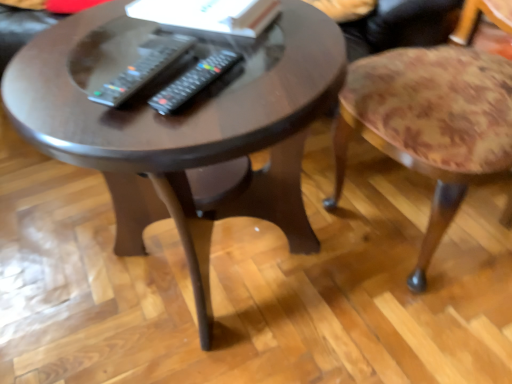
Identify the location of black plastic remote at center, acting as the 1th remote starting from the right. (193, 81).

Describe the element at coordinates (181, 122) in the screenshot. I see `dark wood coffee table at center` at that location.

At what (x,y) coordinates should I click in order to perform the action: click on black plastic remote at center, acting as the 1th remote starting from the right. Please return your answer as a coordinate pair (x, y). Looking at the image, I should click on (193, 81).

Based on the photo, from a real-world perspective, who is located higher, dark wood coffee table at center or floral fabric stool at right?

floral fabric stool at right.

You are a GUI agent. You are given a task and a screenshot of the screen. Output one action in this format:
    pyautogui.click(x=<x>, y=<y>)
    Task: Click on the coffee table located in front of the floral fabric stool at right
    The height and width of the screenshot is (384, 512).
    Given the screenshot: What is the action you would take?
    pyautogui.click(x=181, y=122)

Is floral fabric stool at right a part of dark wood coffee table at center?

Definitely not — floral fabric stool at right is not inside dark wood coffee table at center.

Which is closer to the camera, (x=325, y=88) or (x=369, y=127)?

Point (x=325, y=88) is closer to the camera than point (x=369, y=127).

Between black plastic remote at center, marked as the second remote in a left-to-right arrangement, and floral fabric stool at right, which one is positioned behind?

black plastic remote at center, marked as the second remote in a left-to-right arrangement, is further from the camera.

Would you say black plastic remote at center, marked as the second remote in a left-to-right arrangement, contains floral fabric stool at right?

No, black plastic remote at center, marked as the second remote in a left-to-right arrangement, does not contain floral fabric stool at right.

Consider the image. Who is smaller, black plastic remote at center, acting as the 1th remote starting from the right, or floral fabric stool at right?

With smaller size is black plastic remote at center, acting as the 1th remote starting from the right.

Considering the relative sizes of floral fabric stool at right and dark wood coffee table at center in the image provided, is floral fabric stool at right bigger than dark wood coffee table at center?

Incorrect, floral fabric stool at right is not larger than dark wood coffee table at center.

Is floral fabric stool at right wider or thinner than dark wood coffee table at center?

In the image, floral fabric stool at right appears to be more narrow than dark wood coffee table at center.

From a real-world perspective, is floral fabric stool at right above or below dark wood coffee table at center?

From a real-world perspective, floral fabric stool at right is physically above dark wood coffee table at center.

From the image's perspective, is floral fabric stool at right above or below dark wood coffee table at center?

From the image's perspective, floral fabric stool at right appears above dark wood coffee table at center.

From the image's perspective, is black plastic remote at center, which appears as the 1th remote when viewed from the left, beneath floral fabric stool at right?

No.

Is black plastic remote at center, which ranks as the second remote in right-to-left order, oriented away from floral fabric stool at right?

black plastic remote at center, which ranks as the second remote in right-to-left order, does not have its back to floral fabric stool at right.

From the picture: How far apart are black plastic remote at center, which ranks as the second remote in right-to-left order, and floral fabric stool at right?

black plastic remote at center, which ranks as the second remote in right-to-left order, is 49.42 centimeters away from floral fabric stool at right.

Are black plastic remote at center, which appears as the 1th remote when viewed from the left, and floral fabric stool at right making contact?

No, black plastic remote at center, which appears as the 1th remote when viewed from the left, is not touching floral fabric stool at right.

From the floral fabric stool at right, count the 2nd remote to the left and point to it. Please provide its 2D coordinates.

[(145, 68)]

Would you say floral fabric stool at right is to the left or to the right of black plastic remote at center, which ranks as the second remote in right-to-left order, in the picture?

In the image, floral fabric stool at right appears on the right side of black plastic remote at center, which ranks as the second remote in right-to-left order.

Is floral fabric stool at right positioned far away from black plastic remote at center, which appears as the 1th remote when viewed from the left?

No, floral fabric stool at right is not far from black plastic remote at center, which appears as the 1th remote when viewed from the left.

Is floral fabric stool at right in front of or behind black plastic remote at center, which ranks as the second remote in right-to-left order, in the image?

In the image, floral fabric stool at right appears in front of black plastic remote at center, which ranks as the second remote in right-to-left order.

How much distance is there between black plastic remote at center, acting as the 1th remote starting from the right, and black plastic remote at center, which ranks as the second remote in right-to-left order?

black plastic remote at center, acting as the 1th remote starting from the right, is 5.69 centimeters from black plastic remote at center, which ranks as the second remote in right-to-left order.

Is black plastic remote at center, acting as the 1th remote starting from the right, in front of or behind black plastic remote at center, which ranks as the second remote in right-to-left order, in the image?

black plastic remote at center, acting as the 1th remote starting from the right, is in front of black plastic remote at center, which ranks as the second remote in right-to-left order.

Which point is more forward, (232, 60) or (118, 102)?

The point (118, 102) is more forward.

Which object is positioned more to the left, black plastic remote at center, acting as the 1th remote starting from the right, or black plastic remote at center, which ranks as the second remote in right-to-left order?

black plastic remote at center, which ranks as the second remote in right-to-left order.

Who is smaller, black plastic remote at center, which appears as the 1th remote when viewed from the left, or black plastic remote at center, marked as the second remote in a left-to-right arrangement?

black plastic remote at center, marked as the second remote in a left-to-right arrangement, is smaller.

Considering the points (113, 89) and (175, 103), which point is behind, point (113, 89) or point (175, 103)?

Positioned behind is point (175, 103).

Identify the location of remote below the black plastic remote at center, which appears as the 1th remote when viewed from the left (from the image's perspective). The height and width of the screenshot is (384, 512). (193, 81).

Can you confirm if black plastic remote at center, which ranks as the second remote in right-to-left order, is shorter than black plastic remote at center, acting as the 1th remote starting from the right?

No, black plastic remote at center, which ranks as the second remote in right-to-left order, is not shorter than black plastic remote at center, acting as the 1th remote starting from the right.

I want to click on stool on the right of dark wood coffee table at center, so [x=430, y=123].

You are a GUI agent. You are given a task and a screenshot of the screen. Output one action in this format:
    pyautogui.click(x=<x>, y=<y>)
    Task: Click on the remote that is the 1st one when counting leftward from the floral fabric stool at right
    
    Given the screenshot: What is the action you would take?
    pyautogui.click(x=193, y=81)

Estimate the real-world distances between objects in this image. Which object is closer to floral fabric stool at right, dark wood coffee table at center or black plastic remote at center, acting as the 1th remote starting from the right?

Based on the image, dark wood coffee table at center appears to be nearer to floral fabric stool at right.

Looking at the image, which one is located closer to dark wood coffee table at center, floral fabric stool at right or black plastic remote at center, acting as the 1th remote starting from the right?

The object closer to dark wood coffee table at center is black plastic remote at center, acting as the 1th remote starting from the right.

Looking at the image, which one is located closer to black plastic remote at center, marked as the second remote in a left-to-right arrangement, black plastic remote at center, which appears as the 1th remote when viewed from the left, or dark wood coffee table at center?

Among the two, black plastic remote at center, which appears as the 1th remote when viewed from the left, is located nearer to black plastic remote at center, marked as the second remote in a left-to-right arrangement.

Based on their spatial positions, is dark wood coffee table at center or black plastic remote at center, marked as the second remote in a left-to-right arrangement, closer to black plastic remote at center, which appears as the 1th remote when viewed from the left?

The object closer to black plastic remote at center, which appears as the 1th remote when viewed from the left, is black plastic remote at center, marked as the second remote in a left-to-right arrangement.

Estimate the real-world distances between objects in this image. Which object is further from dark wood coffee table at center, black plastic remote at center, which ranks as the second remote in right-to-left order, or floral fabric stool at right?

Among the two, floral fabric stool at right is located further to dark wood coffee table at center.

When comparing their distances from black plastic remote at center, acting as the 1th remote starting from the right, does black plastic remote at center, which ranks as the second remote in right-to-left order, or floral fabric stool at right seem closer?

black plastic remote at center, which ranks as the second remote in right-to-left order.

Looking at the image, which one is located further to black plastic remote at center, marked as the second remote in a left-to-right arrangement, dark wood coffee table at center or floral fabric stool at right?

Based on the image, floral fabric stool at right appears to be further to black plastic remote at center, marked as the second remote in a left-to-right arrangement.

In the scene shown: Looking at the image, which one is located closer to black plastic remote at center, which appears as the 1th remote when viewed from the left, dark wood coffee table at center or floral fabric stool at right?

Based on the image, dark wood coffee table at center appears to be nearer to black plastic remote at center, which appears as the 1th remote when viewed from the left.

Identify the location of remote located between dark wood coffee table at center and floral fabric stool at right in the left-right direction. (193, 81).

Locate an element on the screen. The height and width of the screenshot is (384, 512). coffee table between black plastic remote at center, which appears as the 1th remote when viewed from the left, and floral fabric stool at right is located at coordinates (181, 122).

At what (x,y) coordinates should I click in order to perform the action: click on remote between black plastic remote at center, which appears as the 1th remote when viewed from the left, and dark wood coffee table at center from top to bottom. Please return your answer as a coordinate pair (x, y). Looking at the image, I should click on [193, 81].

You are a GUI agent. You are given a task and a screenshot of the screen. Output one action in this format:
    pyautogui.click(x=<x>, y=<y>)
    Task: Click on the remote situated between black plastic remote at center, which ranks as the second remote in right-to-left order, and floral fabric stool at right from left to right
    The height and width of the screenshot is (384, 512).
    Given the screenshot: What is the action you would take?
    pyautogui.click(x=193, y=81)